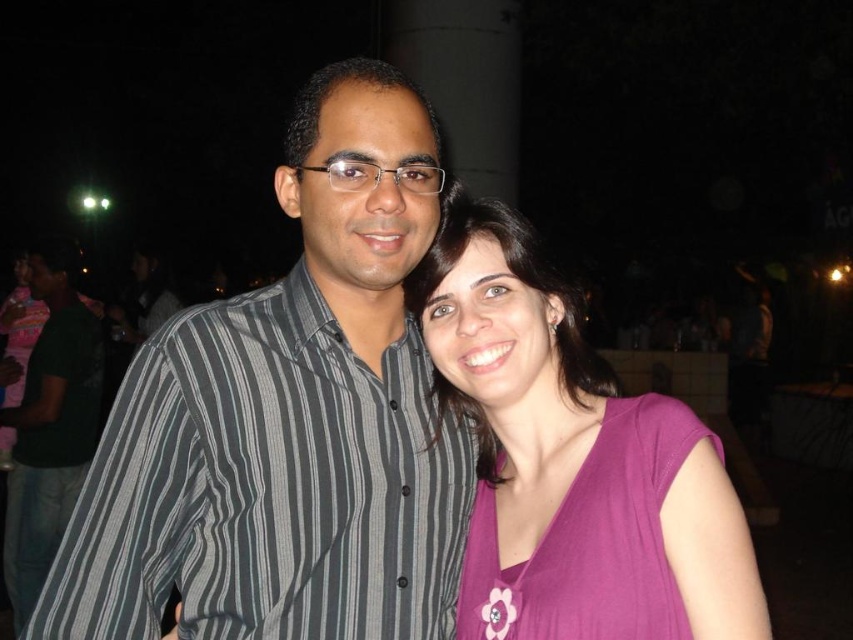
Is point (515, 504) behind point (683, 416)?

Yes, point (515, 504) is farther from viewer.

Can you confirm if purple matte shirt at center is smaller than purple fabric dress at right?

No.

In order to click on purple matte shirt at center in this screenshot , I will do `click(572, 461)`.

Locate an element on the screen. purple matte shirt at center is located at coordinates (572, 461).

Which is more to the right, striped shirt at center or purple matte shirt at center?

purple matte shirt at center

Can you confirm if striped shirt at center is positioned to the left of purple matte shirt at center?

Indeed, striped shirt at center is positioned on the left side of purple matte shirt at center.

You are a GUI agent. You are given a task and a screenshot of the screen. Output one action in this format:
    pyautogui.click(x=<x>, y=<y>)
    Task: Click on the striped shirt at center
    This screenshot has width=853, height=640.
    Given the screenshot: What is the action you would take?
    pyautogui.click(x=288, y=420)

Where is `striped shirt at center`? The width and height of the screenshot is (853, 640). striped shirt at center is located at coordinates (288, 420).

How far apart are purple matte shirt at center and dark green shirt at left?

purple matte shirt at center and dark green shirt at left are 10.43 feet apart.

Between purple matte shirt at center and dark green shirt at left, which one is positioned lower?

dark green shirt at left

Who is more forward, (606, 576) or (24, 531)?

Positioned in front is point (606, 576).

The image size is (853, 640). Find the location of `purple matte shirt at center`. purple matte shirt at center is located at coordinates (572, 461).